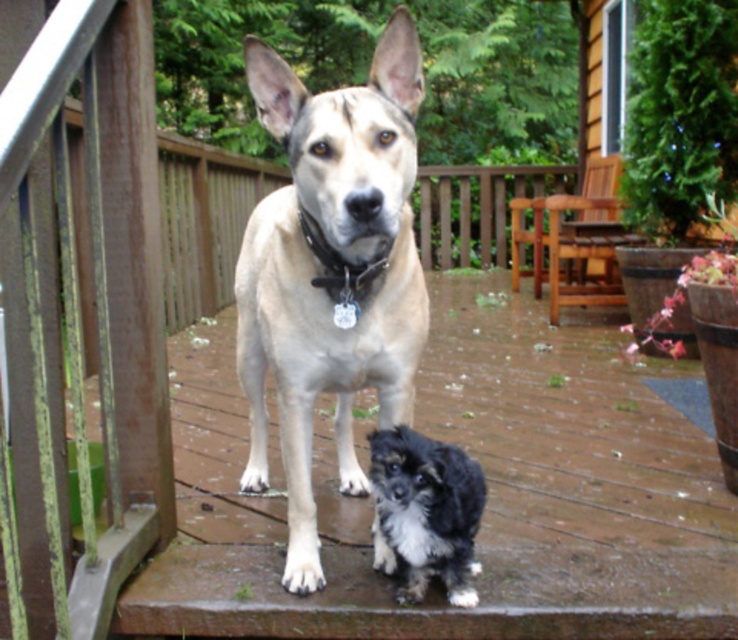
Question: Which object is positioned closest to the black fuzzy dog at lower center?

Choices:
 (A) light brown fur dog at center
 (B) metallic chain at center

Answer: (A)

Question: Which object is the closest to the light brown fur dog at center?

Choices:
 (A) metallic chain at center
 (B) black fuzzy dog at lower center

Answer: (A)

Question: Does light brown fur dog at center have a lesser width compared to metallic chain at center?

Choices:
 (A) no
 (B) yes

Answer: (A)

Question: Does light brown fur dog at center have a lesser width compared to metallic chain at center?

Choices:
 (A) no
 (B) yes

Answer: (A)

Question: Which object appears farthest from the camera in this image?

Choices:
 (A) metallic chain at center
 (B) black fuzzy dog at lower center
 (C) light brown fur dog at center

Answer: (A)

Question: Can you confirm if light brown fur dog at center is bigger than metallic chain at center?

Choices:
 (A) no
 (B) yes

Answer: (B)